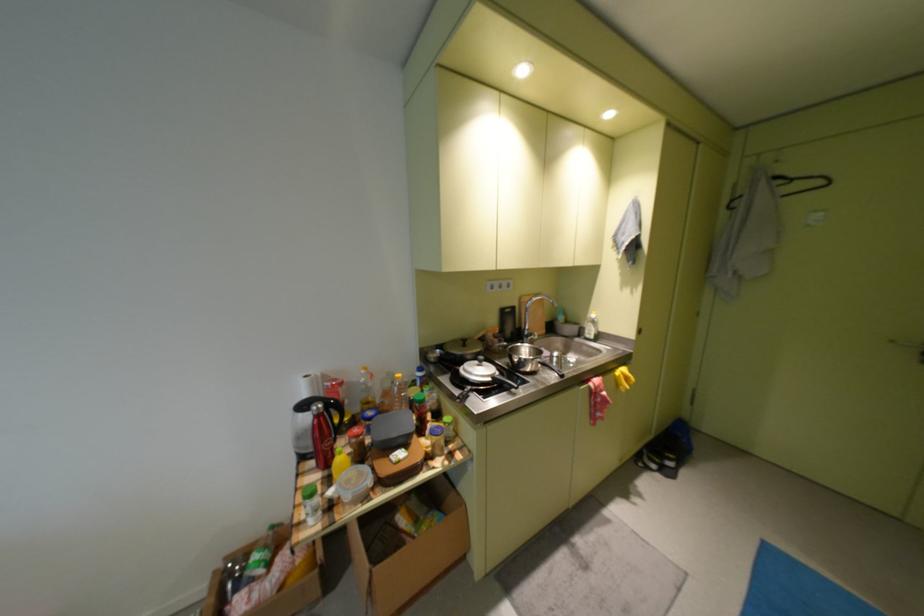
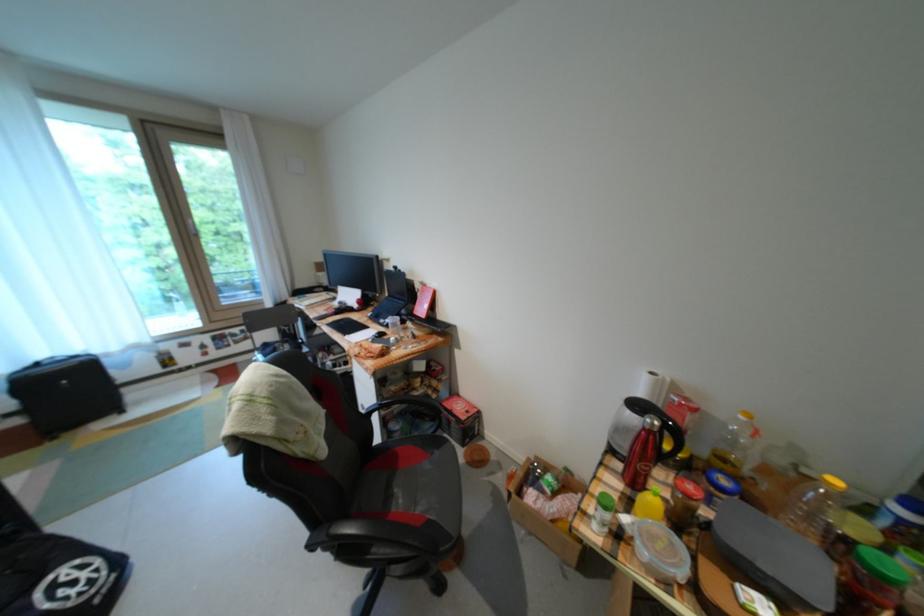
In the second image, find the point that corresponds to the point at 333,419 in the first image.

(662, 438)